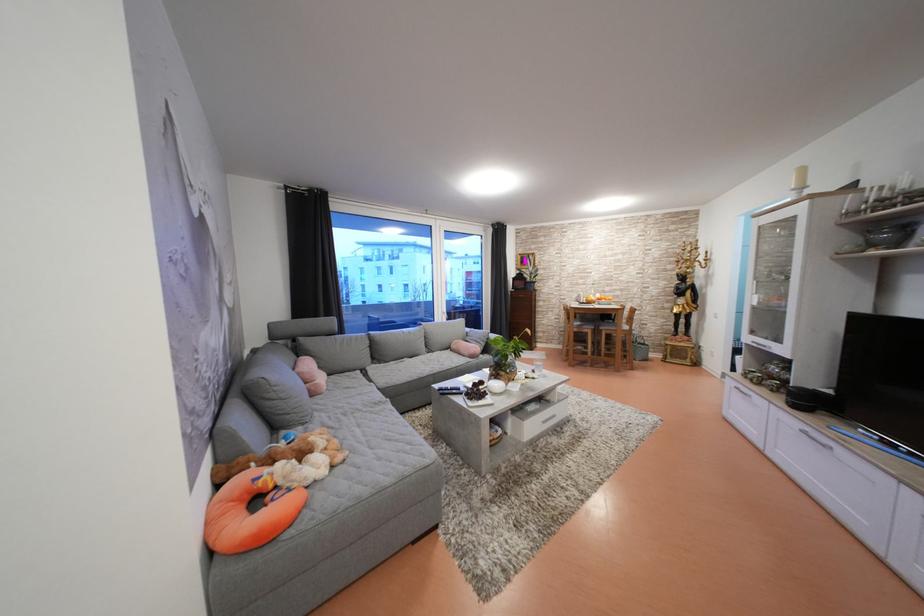
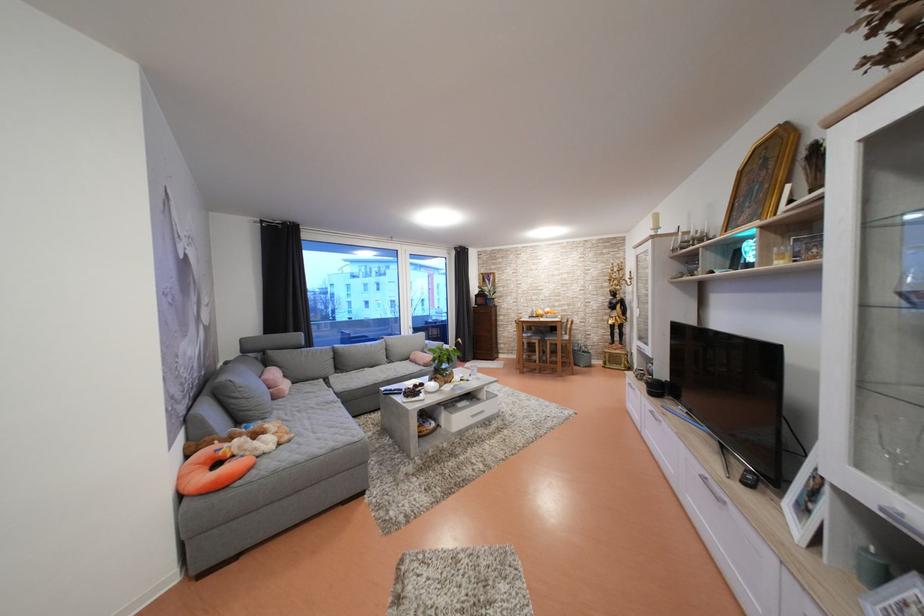
The point at (335, 379) is marked in the first image. Where is the corresponding point in the second image?

(300, 387)